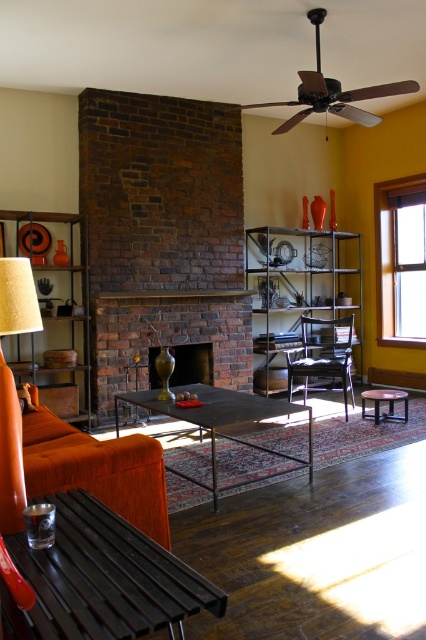
You are a delivery person who needs to place a large package that is 1.5 meters long between the metallic black coffee table at center and the matte orange armchair at center. Can you fit the package between them without moving either object?

The distance between the metallic black coffee table at center and the matte orange armchair at center is 1.52 meters. Since the package is 1.5 meters long, it can fit between them with 2 centimeters of space remaining.

You are moving a large rectangular box that is 2 meters wide. You need to move it through the living room to place it near the fireplace. The path between the velvet orange couch at lower left and the matte bronze fireplace at center is narrow. Will the box fit through this path?

The velvet orange couch at lower left is thinner than the matte bronze fireplace at center. Since the path between them is narrow, the box that is 2 meters wide may not fit through the path between the velvet orange couch at lower left and the matte bronze fireplace at center. The path width is likely narrower than 2 meters, so the box might not fit.

You are arranging a party in the living room and want to place a large rectangular table between the velvet orange couch at lower left and the matte bronze fireplace at center. The table is 1.2 meters wide. Can the table fit between them?

The velvet orange couch at lower left is positioned on the right side of matte bronze fireplace at center. Since the table is 1.2 meters wide, it depends on the available space between them. However, the description does not provide specific distance measurements between the two objects. Therefore, it is unclear if the table can fit without additional information.